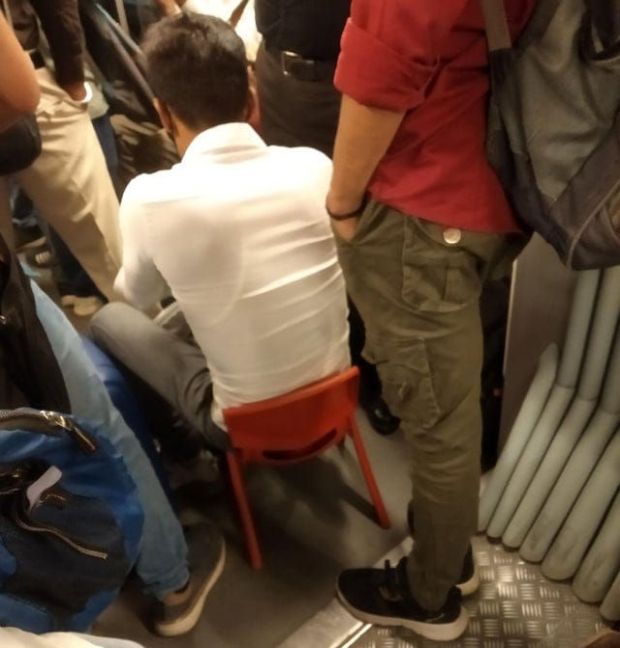
The width and height of the screenshot is (620, 648). What are the coordinates of `wall` in the screenshot? It's located at (552, 291).